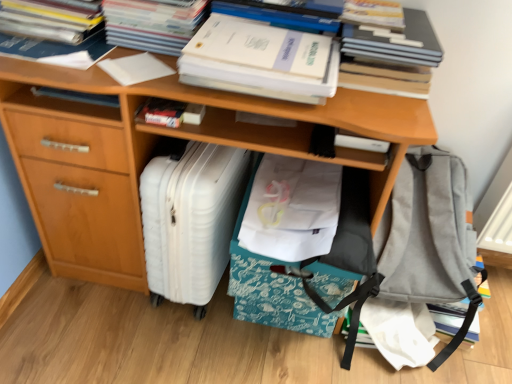
Question: Considering the relative sizes of white paper at upper left, which is counted as the second book, starting from the left, and white plastic suitcase at lower left in the image provided, is white paper at upper left, which is counted as the second book, starting from the left, taller than white plastic suitcase at lower left?

Choices:
 (A) yes
 (B) no

Answer: (B)

Question: Can you confirm if white paper at upper left, acting as the fifth book starting from the right, is positioned to the left of white plastic suitcase at lower left?

Choices:
 (A) no
 (B) yes

Answer: (B)

Question: From a real-world perspective, does white paper at upper left, acting as the fifth book starting from the right, stand above white plastic suitcase at lower left?

Choices:
 (A) no
 (B) yes

Answer: (B)

Question: Is white paper at upper left, acting as the fifth book starting from the right, thinner than white plastic suitcase at lower left?

Choices:
 (A) no
 (B) yes

Answer: (A)

Question: Is white paper at upper left, acting as the fifth book starting from the right, looking in the opposite direction of white plastic suitcase at lower left?

Choices:
 (A) no
 (B) yes

Answer: (A)

Question: Considering the relative positions of white fabric at center and white plastic suitcase at lower left in the image provided, is white fabric at center to the left or to the right of white plastic suitcase at lower left?

Choices:
 (A) right
 (B) left

Answer: (A)

Question: In terms of width, does white fabric at center look wider or thinner when compared to white plastic suitcase at lower left?

Choices:
 (A) wide
 (B) thin

Answer: (A)

Question: Does point (259, 221) appear closer or farther from the camera than point (151, 198)?

Choices:
 (A) farther
 (B) closer

Answer: (B)

Question: From their relative heights in the image, would you say white fabric at center is taller or shorter than white plastic suitcase at lower left?

Choices:
 (A) short
 (B) tall

Answer: (A)

Question: Is white matte book at center, positioned as the 4th book in left-to-right order, to the left or to the right of white paper at upper left, which appears as the 4th book when viewed from the right, in the image?

Choices:
 (A) right
 (B) left

Answer: (A)

Question: Considering the positions of point (204, 110) and point (117, 57), is point (204, 110) closer or farther from the camera than point (117, 57)?

Choices:
 (A) farther
 (B) closer

Answer: (A)

Question: Is white matte book at center, positioned as the 4th book in left-to-right order, taller or shorter than white paper at upper left, which is counted as the 3th book, starting from the left?

Choices:
 (A) tall
 (B) short

Answer: (A)

Question: Do you think white matte book at center, positioned as the 4th book in left-to-right order, is within white paper at upper left, which appears as the 4th book when viewed from the right, or outside of it?

Choices:
 (A) outside
 (B) inside

Answer: (A)

Question: Does point (422, 36) appear closer or farther from the camera than point (292, 49)?

Choices:
 (A) farther
 (B) closer

Answer: (A)

Question: In the image, is hardcover book at upper right, the 1th book when ordered from right to left, positioned in front of or behind white matte paper at upper center, which appears as the first paperback book when viewed from the right?

Choices:
 (A) front
 (B) behind

Answer: (B)